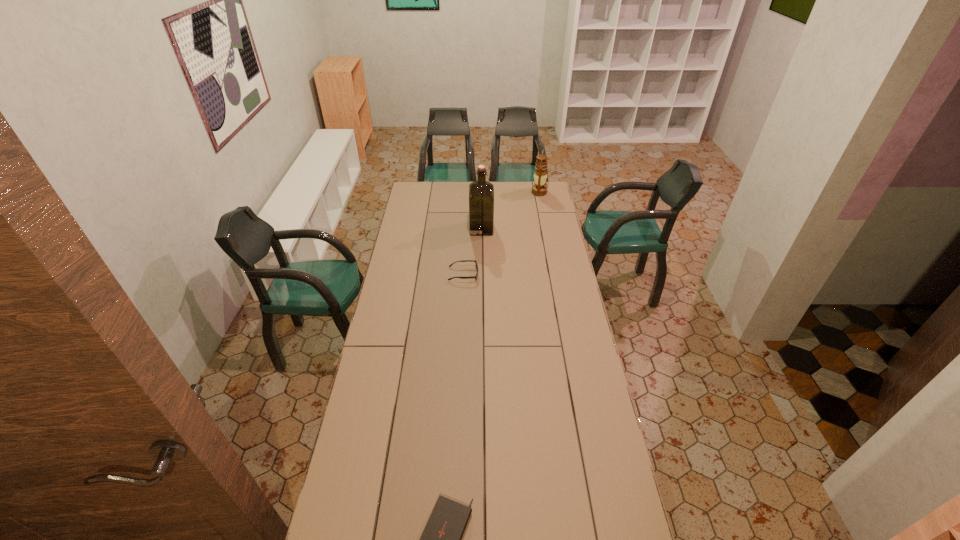
Where is `blank space located 0.110m on the front-facing side of the third tallest object`? blank space located 0.110m on the front-facing side of the third tallest object is located at coordinates (500, 274).

Image resolution: width=960 pixels, height=540 pixels. In order to click on object positioned at the far edge in this screenshot , I will do `click(540, 176)`.

Image resolution: width=960 pixels, height=540 pixels. Find the location of `object located in the right edge section of the desktop`. object located in the right edge section of the desktop is located at coordinates (540, 176).

At what (x,y) coordinates should I click in order to perform the action: click on object situated at the far right corner. Please return your answer as a coordinate pair (x, y). Looking at the image, I should click on [x=540, y=176].

The width and height of the screenshot is (960, 540). I want to click on vacant region at the far edge of the desktop, so click(x=490, y=181).

You are a GUI agent. You are given a task and a screenshot of the screen. Output one action in this format:
    pyautogui.click(x=<x>, y=<y>)
    Task: Click on the vacant point at the left edge
    
    Given the screenshot: What is the action you would take?
    pyautogui.click(x=396, y=269)

In the image, there is a desktop. Identify the location of free region at the right edge. (566, 287).

Identify the location of empty space between the third farthest object and the tallest object. The height and width of the screenshot is (540, 960). (472, 251).

Locate an element on the screen. free spot between the second tallest object and the sunglasses is located at coordinates (501, 233).

Where is `free point between the second nearest object and the rightmost object`? free point between the second nearest object and the rightmost object is located at coordinates (501, 233).